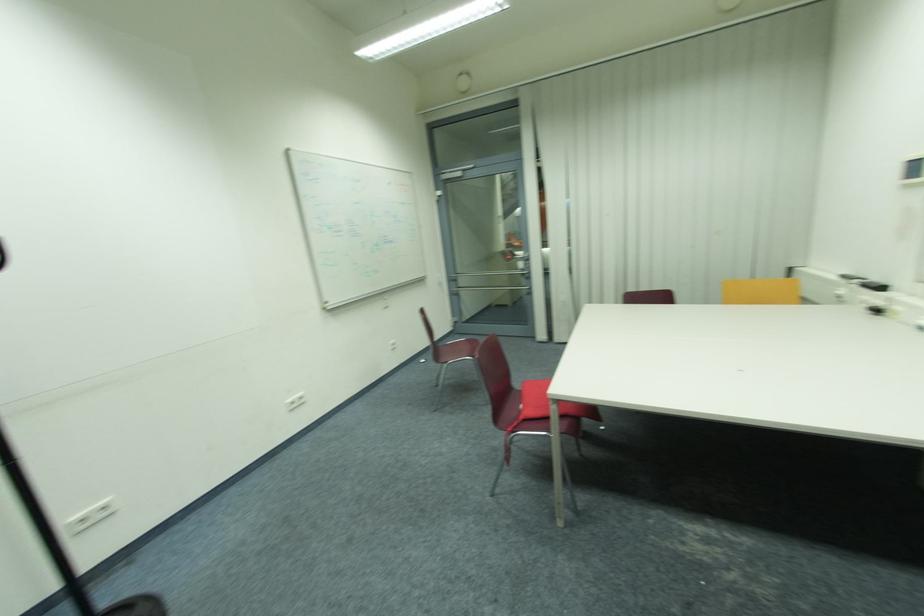
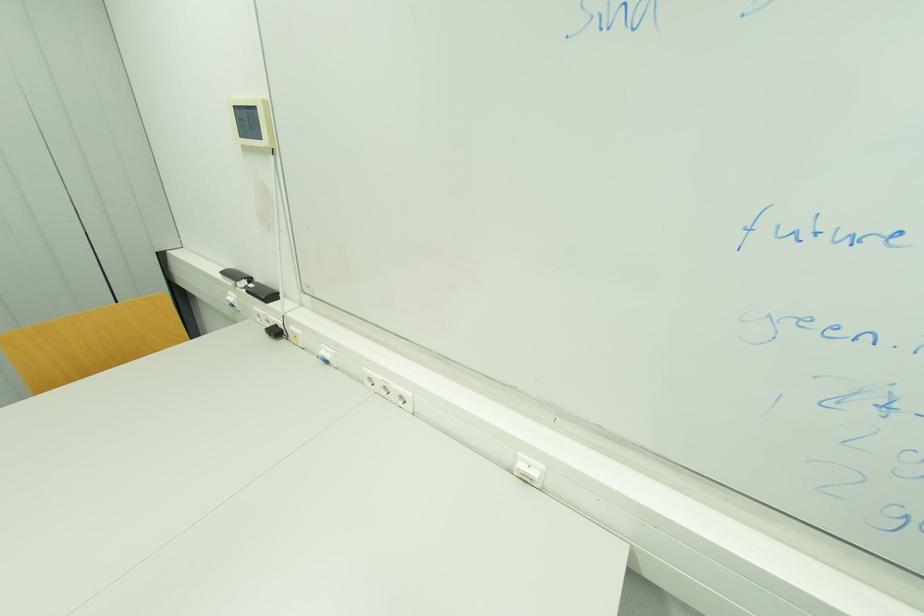
The point at (882, 313) is marked in the first image. Where is the corresponding point in the second image?

(281, 333)